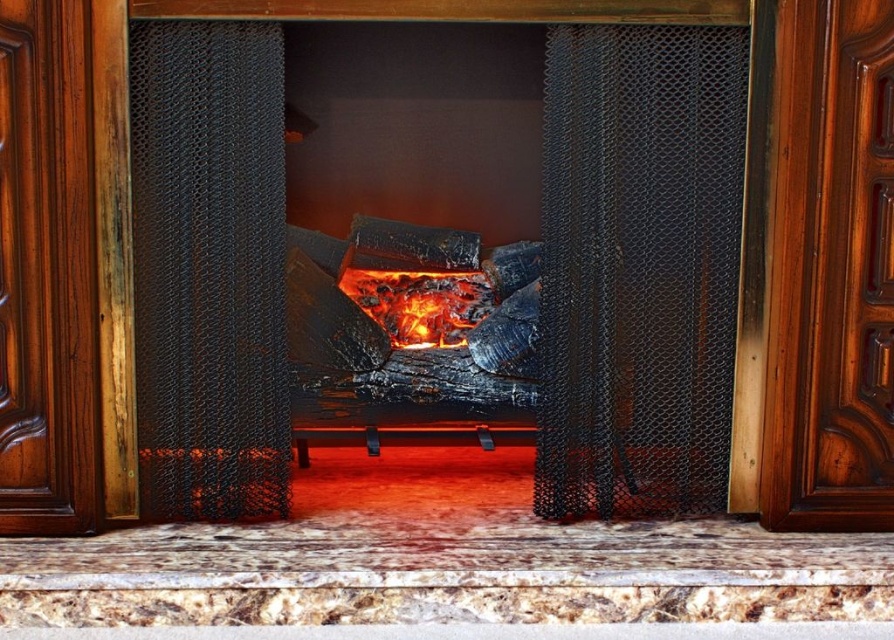
You are standing in front of the fireplace and see two points marked in the scene. The first point is at coordinates point (204, 221) and the second is at point (445, 321). Which point is closer to you?

Point (204, 221) is in front of point (445, 321), so it is closer to you.

You are standing in front of the fireplace and want to see the flames better. The matte black fireplace screen at center is blocking your view. Can you move it to the side to get a clearer view of the flames?

The matte black fireplace screen at center is positioned at point [481,266], so you can move it to the side to get a clearer view of the flames.

You are a firefighter assessing a fire scene. You need to place a heat sensor between the matte black fireplace screen at center and the glowing embers at center. The sensor requires a minimum of 24 inches of clearance from any heat source. Can the sensor be placed safely in this location?

The distance between the matte black fireplace screen at center and the glowing embers at center is 24.32 inches. Since the sensor requires a minimum of 24 inches of clearance, placing it at this distance would meet the requirement, so it is safe to place the sensor here.